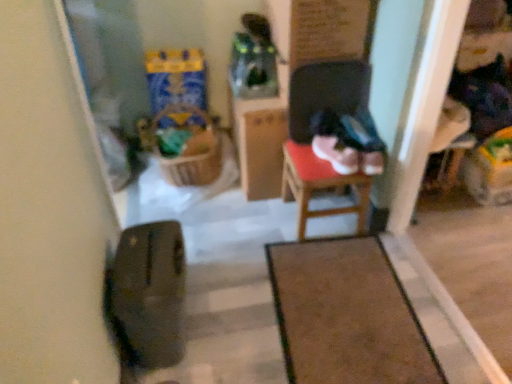
Question: Is woven brown laundry basket at center inside the boundaries of brown carpet at center, or outside?

Choices:
 (A) inside
 (B) outside

Answer: (B)

Question: From the image's perspective, relative to brown carpet at center, is woven brown laundry basket at center above or below?

Choices:
 (A) above
 (B) below

Answer: (A)

Question: Which is farther from the wooden armchair at right?

Choices:
 (A) wooden chair at center
 (B) brown carpet at center
 (C) transparent glass door at left
 (D) woven brown laundry basket at center

Answer: (C)

Question: Estimate the real-world distances between objects in this image. Which object is farther from the woven brown laundry basket at center?

Choices:
 (A) brown carpet at center
 (B) transparent glass door at left
 (C) wooden chair at center
 (D) wooden armchair at right

Answer: (D)